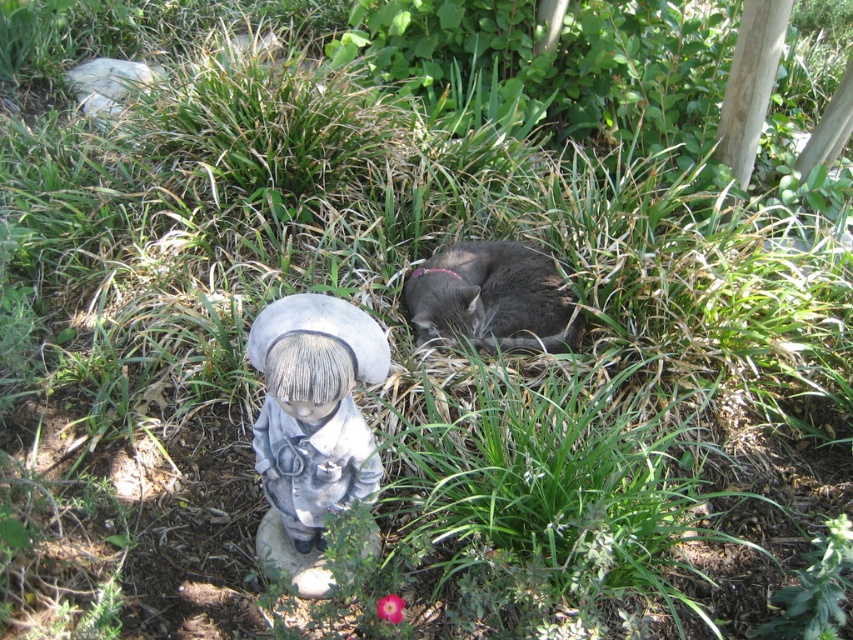
Question: In this image, where is gray stone figurine at lower left located relative to gray fur cat at center?

Choices:
 (A) above
 (B) below

Answer: (B)

Question: Does gray stone figurine at lower left lie behind gray fur cat at center?

Choices:
 (A) no
 (B) yes

Answer: (A)

Question: Which of the following is the farthest from the observer?

Choices:
 (A) (276, 337)
 (B) (445, 308)

Answer: (B)

Question: Does gray stone figurine at lower left have a lesser width compared to gray fur cat at center?

Choices:
 (A) yes
 (B) no

Answer: (A)